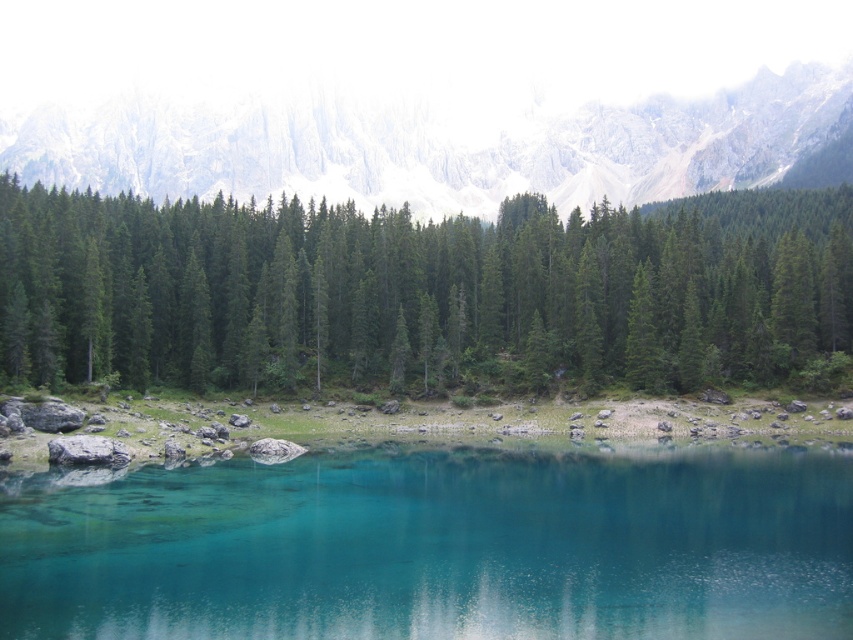
Question: Which of the following is the farthest from the observer?

Choices:
 (A) green matte pine forest at center
 (B) transparent glass water at center

Answer: (A)

Question: Based on their relative distances, which object is farther from the transparent glass water at center?

Choices:
 (A) green matte pine forest at center
 (B) white rocky mountain at upper center

Answer: (B)

Question: Is green matte pine forest at center thinner than transparent glass water at center?

Choices:
 (A) no
 (B) yes

Answer: (A)

Question: Considering the relative positions of green matte pine forest at center and transparent glass water at center in the image provided, where is green matte pine forest at center located with respect to transparent glass water at center?

Choices:
 (A) below
 (B) above

Answer: (B)

Question: Does green matte pine forest at center appear on the right side of white rocky mountain at upper center?

Choices:
 (A) yes
 (B) no

Answer: (A)

Question: Which point is closer to the camera taking this photo?

Choices:
 (A) (845, 100)
 (B) (833, 228)

Answer: (B)